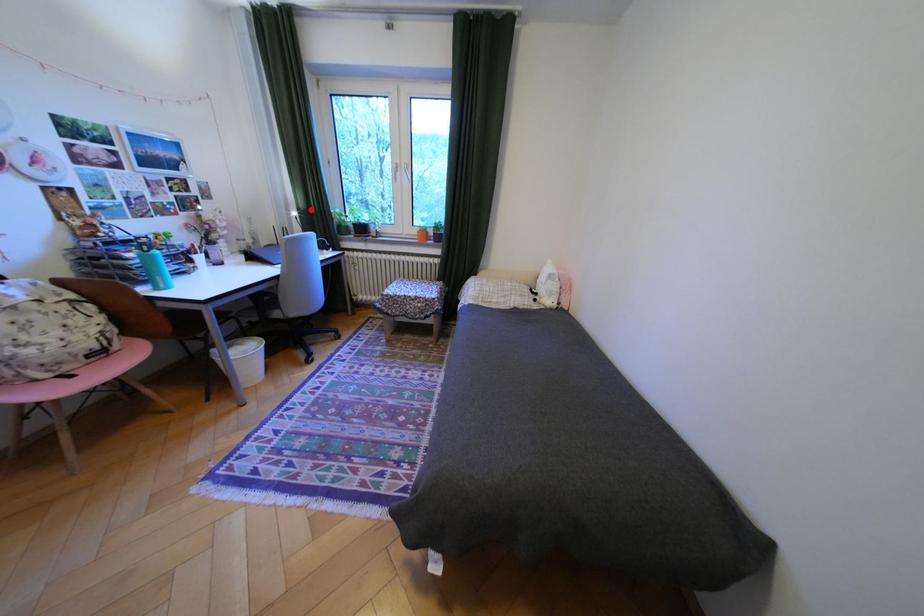
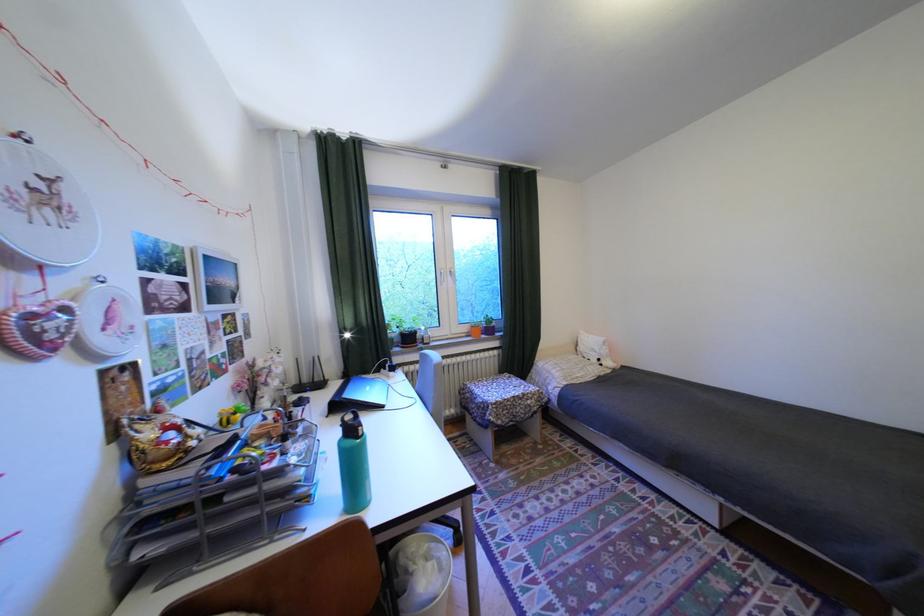
Question: I am providing you with two images of the same scene from different viewpoints. In image1, a red point is highlighted. Considering the same 3D point in image2, which of the following is correct?

Choices:
 (A) It is closer
 (B) It is farther

Answer: (B)